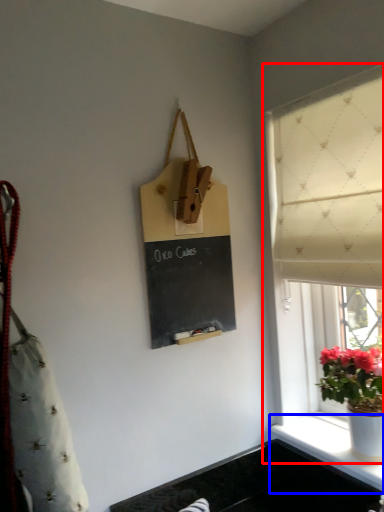
Question: Which point is further to the camera, window (highlighted by a red box) or window sill (highlighted by a blue box)?

Choices:
 (A) window
 (B) window sill

Answer: (B)